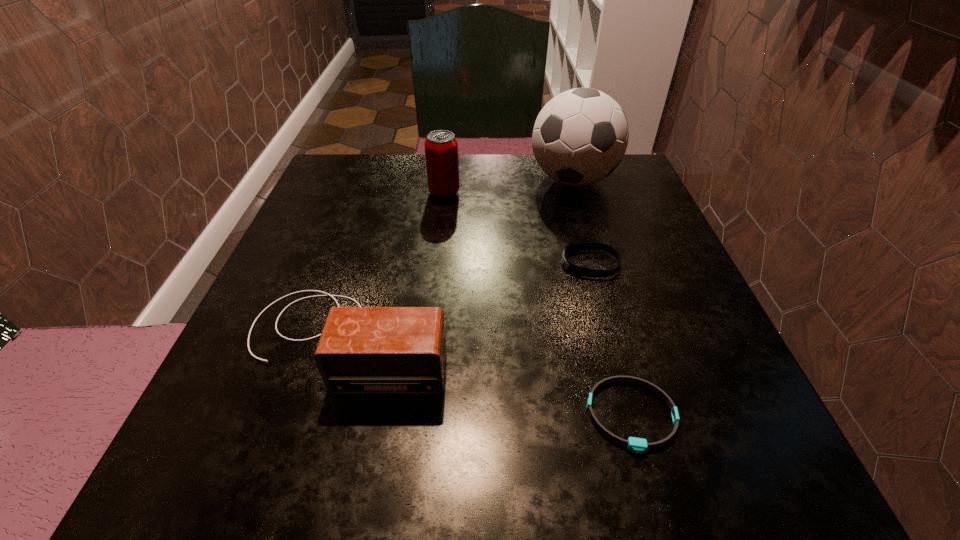
Find the location of a particular element. Image resolution: width=960 pixels, height=540 pixels. the tallest object is located at coordinates (580, 136).

Identify the location of can. (441, 147).

At what (x,y) coordinates should I click in order to perform the action: click on radio receiver. Please return your answer as a coordinate pair (x, y). Looking at the image, I should click on (362, 350).

The width and height of the screenshot is (960, 540). Find the location of `the third nearest object`. the third nearest object is located at coordinates (573, 269).

Identify the location of the taller wristband. (573, 269).

The image size is (960, 540). Find the location of `the nearer wristband`. the nearer wristband is located at coordinates (635, 445).

At what (x,y) coordinates should I click in order to perform the action: click on the shorter wristband. Please return your answer as a coordinate pair (x, y). Looking at the image, I should click on (635, 445).

The height and width of the screenshot is (540, 960). Find the location of `vacant space situated 0.350m on the front of the tallest object`. vacant space situated 0.350m on the front of the tallest object is located at coordinates (615, 326).

This screenshot has height=540, width=960. What are the coordinates of `vacant space situated on the front of the can` in the screenshot? It's located at (435, 278).

This screenshot has height=540, width=960. What are the coordinates of `vacant area situated on the front-facing side of the radio receiver` in the screenshot? It's located at (303, 494).